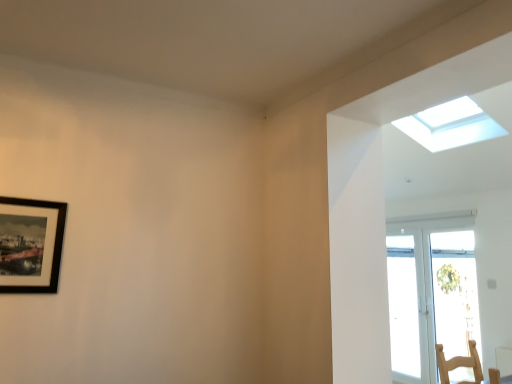
Question: In terms of width, does transparent glass window at upper right look wider or thinner when compared to black matte picture frame at upper left?

Choices:
 (A) thin
 (B) wide

Answer: (B)

Question: Based on their sizes in the image, would you say transparent glass window at upper right is bigger or smaller than black matte picture frame at upper left?

Choices:
 (A) small
 (B) big

Answer: (B)

Question: Is transparent glass window at upper right situated inside black matte picture frame at upper left or outside?

Choices:
 (A) outside
 (B) inside

Answer: (A)

Question: From the image's perspective, relative to transparent glass window at upper right, is black matte picture frame at upper left above or below?

Choices:
 (A) below
 (B) above

Answer: (A)

Question: Considering the positions of point (23, 213) and point (432, 127), is point (23, 213) closer or farther from the camera than point (432, 127)?

Choices:
 (A) closer
 (B) farther

Answer: (A)

Question: From a real-world perspective, is black matte picture frame at upper left above or below transparent glass window at upper right?

Choices:
 (A) below
 (B) above

Answer: (A)

Question: Looking at the image, does black matte picture frame at upper left seem bigger or smaller compared to transparent glass window at upper right?

Choices:
 (A) big
 (B) small

Answer: (B)